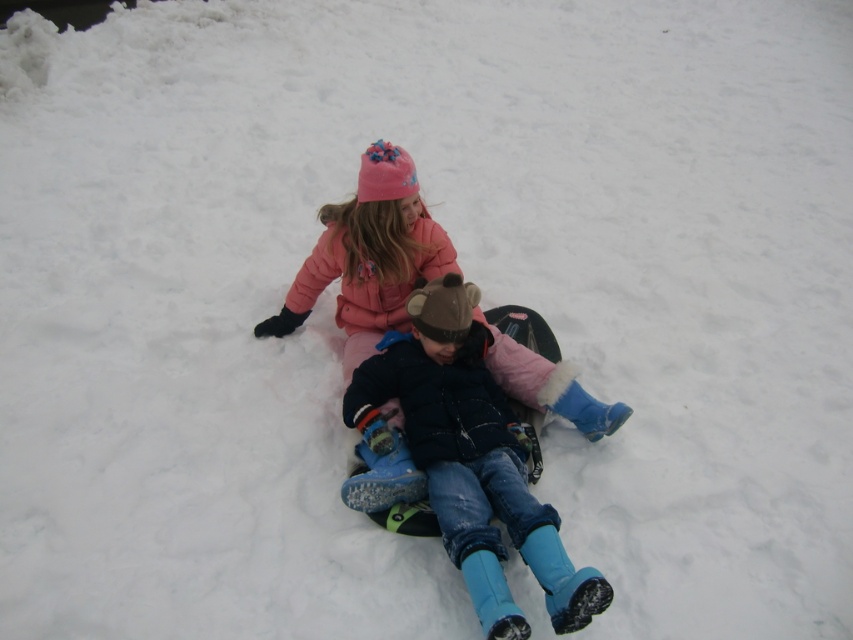
You are a photographer trying to capture both the blue fuzzy boots at center and the matte pink coat at center in a single frame. Since you want to ensure both are visible, which object should you focus on first to account for their sizes?

The blue fuzzy boots at center has a lesser width compared to matte pink coat at center, so you should focus on the matte pink coat at center first since it is larger and might require more attention to detail to fit within the frame properly.